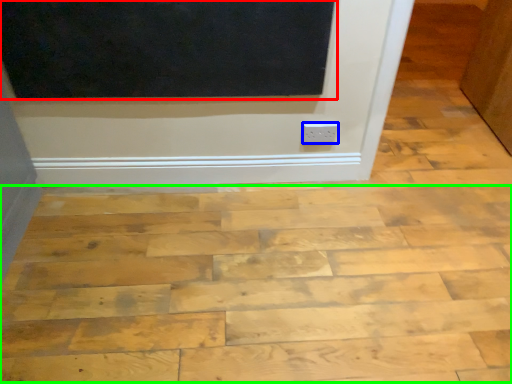
Question: Which object is positioned farthest from screen door (highlighted by a red box)? Select from electric outlet (highlighted by a blue box) and plywood (highlighted by a green box).

Choices:
 (A) electric outlet
 (B) plywood

Answer: (B)